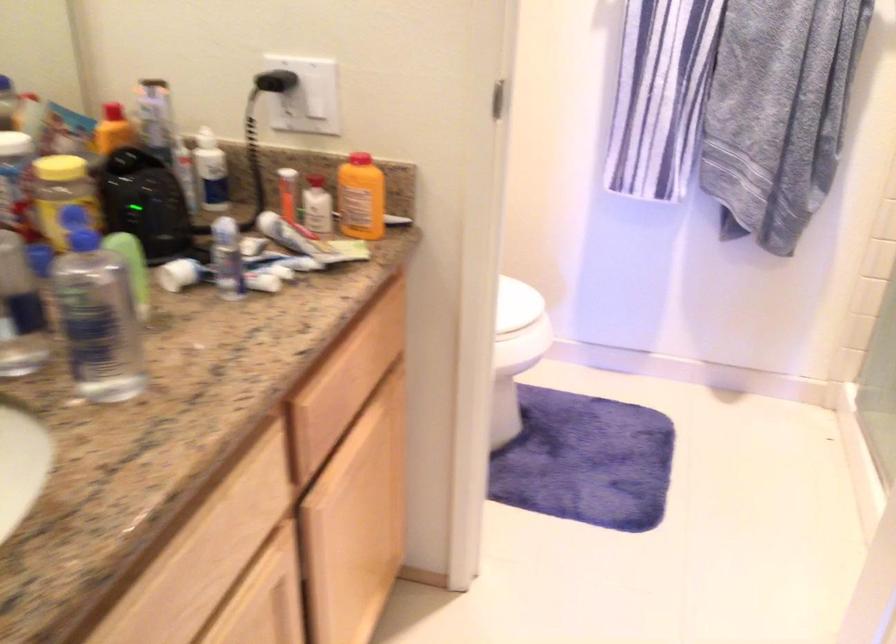
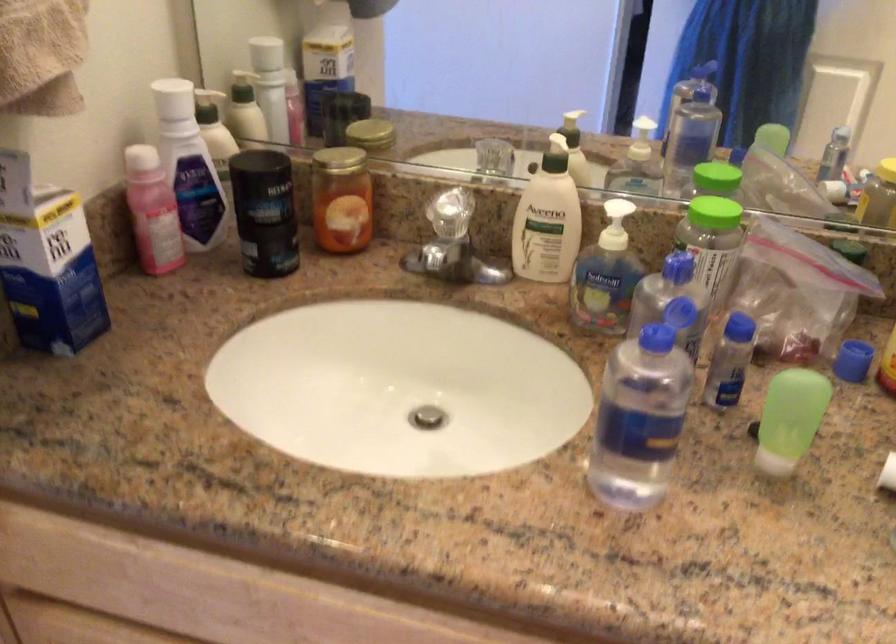
Find the pixel in the second image that matches (149,265) in the first image.

(789, 419)